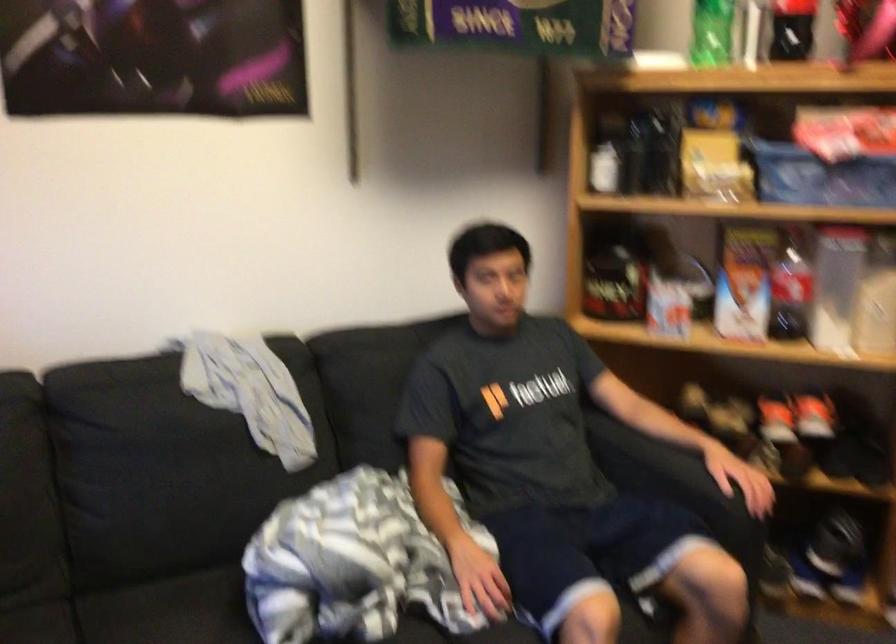
Where is `soda bottle`? soda bottle is located at coordinates (607, 154).